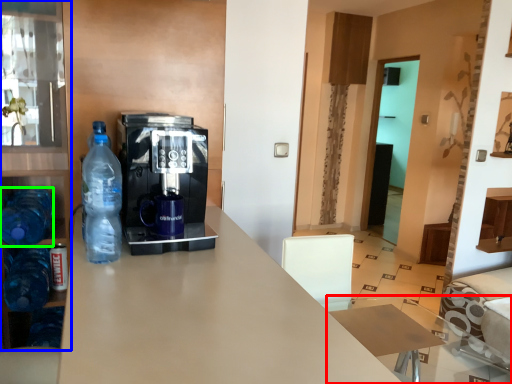
Question: Which object is the closest to the table (highlighted by a red box)? Choose among these: cabinetry (highlighted by a blue box) or bottle (highlighted by a green box).

Choices:
 (A) cabinetry
 (B) bottle

Answer: (B)